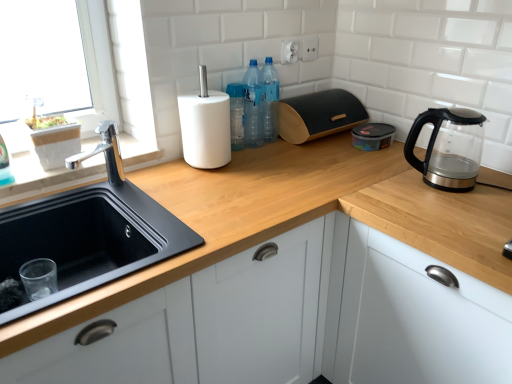
Question: Considering the relative sizes of transparent glass kettle at right and black wood bread bin at upper center in the image provided, is transparent glass kettle at right shorter than black wood bread bin at upper center?

Choices:
 (A) yes
 (B) no

Answer: (B)

Question: From a real-world perspective, is transparent glass kettle at right over black wood bread bin at upper center?

Choices:
 (A) yes
 (B) no

Answer: (A)

Question: Is transparent glass kettle at right thinner than black wood bread bin at upper center?

Choices:
 (A) no
 (B) yes

Answer: (B)

Question: Could you tell me if transparent glass kettle at right is turned towards black wood bread bin at upper center?

Choices:
 (A) no
 (B) yes

Answer: (A)

Question: From the image's perspective, is transparent glass kettle at right on top of black wood bread bin at upper center?

Choices:
 (A) yes
 (B) no

Answer: (B)

Question: Looking at their shapes, would you say wooden at upper center is wider or thinner than black wood bread bin at upper center?

Choices:
 (A) thin
 (B) wide

Answer: (B)

Question: Is wooden at upper center in front of or behind black wood bread bin at upper center in the image?

Choices:
 (A) behind
 (B) front

Answer: (B)

Question: Considering the positions of wooden at upper center and black wood bread bin at upper center in the image, is wooden at upper center bigger or smaller than black wood bread bin at upper center?

Choices:
 (A) big
 (B) small

Answer: (A)

Question: From a real-world perspective, is wooden at upper center physically located above or below black wood bread bin at upper center?

Choices:
 (A) below
 (B) above

Answer: (A)

Question: Is black wood bread bin at upper center bigger or smaller than translucent plastic bottles at upper center, the second bottle in the left-to-right sequence?

Choices:
 (A) big
 (B) small

Answer: (A)

Question: Would you say black wood bread bin at upper center is inside or outside translucent plastic bottles at upper center, which appears as the 1th bottle when viewed from the right?

Choices:
 (A) inside
 (B) outside

Answer: (B)

Question: Considering the relative positions of black wood bread bin at upper center and translucent plastic bottles at upper center, the second bottle in the left-to-right sequence, in the image provided, is black wood bread bin at upper center to the left or to the right of translucent plastic bottles at upper center, the second bottle in the left-to-right sequence,?

Choices:
 (A) right
 (B) left

Answer: (A)

Question: Considering their positions, is black wood bread bin at upper center located in front of or behind translucent plastic bottles at upper center, the second bottle in the left-to-right sequence?

Choices:
 (A) front
 (B) behind

Answer: (B)

Question: Is black matte sink at lower left bigger or smaller than black plastic container at upper center?

Choices:
 (A) small
 (B) big

Answer: (B)

Question: Looking at their shapes, would you say black matte sink at lower left is wider or thinner than black plastic container at upper center?

Choices:
 (A) thin
 (B) wide

Answer: (B)